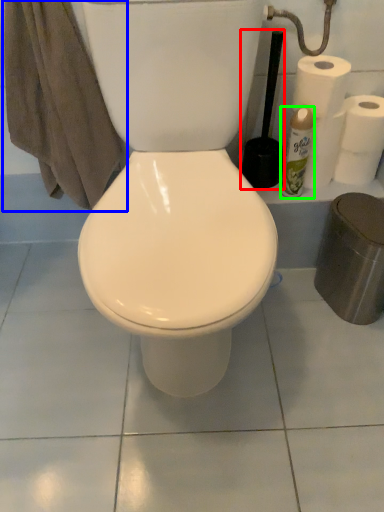
Question: Which is farther away from brush (highlighted by a red box)? bath towel (highlighted by a blue box) or cleaning product (highlighted by a green box)?

Choices:
 (A) bath towel
 (B) cleaning product

Answer: (A)